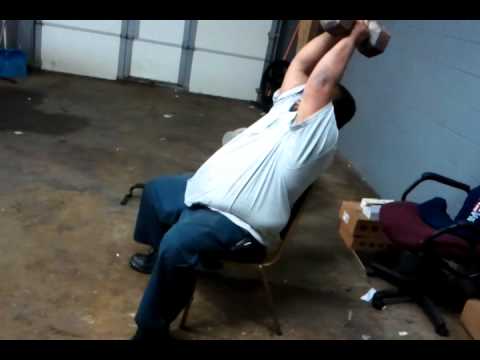
Where is `wall`? The height and width of the screenshot is (360, 480). wall is located at coordinates (415, 91).